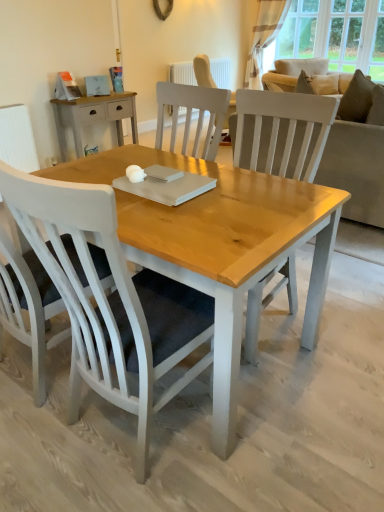
Question: Is white painted radiator at upper center further to the viewer compared to white painted wood chair at center, arranged as the 1th chair when viewed from the right?

Choices:
 (A) yes
 (B) no

Answer: (A)

Question: From a real-world perspective, is white painted radiator at upper center on top of white painted wood chair at center, marked as the 2th chair in a left-to-right arrangement?

Choices:
 (A) yes
 (B) no

Answer: (B)

Question: Considering the relative sizes of white painted radiator at upper center and white painted wood chair at center, marked as the 2th chair in a left-to-right arrangement, in the image provided, is white painted radiator at upper center wider than white painted wood chair at center, marked as the 2th chair in a left-to-right arrangement,?

Choices:
 (A) yes
 (B) no

Answer: (B)

Question: Is white painted radiator at upper center aimed at white painted wood chair at center, arranged as the 1th chair when viewed from the right?

Choices:
 (A) yes
 (B) no

Answer: (B)

Question: Considering the relative sizes of white painted radiator at upper center and white painted wood chair at center, arranged as the 1th chair when viewed from the right, in the image provided, is white painted radiator at upper center shorter than white painted wood chair at center, arranged as the 1th chair when viewed from the right,?

Choices:
 (A) yes
 (B) no

Answer: (A)

Question: Considering the positions of light brown wood desk at upper left and white painted wood chair at left, the 1th chair viewed from the left, in the image, is light brown wood desk at upper left wider or thinner than white painted wood chair at left, the 1th chair viewed from the left,?

Choices:
 (A) thin
 (B) wide

Answer: (A)

Question: Would you say light brown wood desk at upper left is to the left or to the right of white painted wood chair at left, arranged as the 2th chair when viewed from the right, in the picture?

Choices:
 (A) left
 (B) right

Answer: (A)

Question: From a real-world perspective, is light brown wood desk at upper left above or below white painted wood chair at left, the 1th chair viewed from the left?

Choices:
 (A) below
 (B) above

Answer: (A)

Question: Considering their positions, is light brown wood desk at upper left located in front of or behind white painted wood chair at left, the 1th chair viewed from the left?

Choices:
 (A) behind
 (B) front

Answer: (A)

Question: From the image's perspective, relative to suede-like beige pillow at upper right, is light beige fabric couch at upper right above or below?

Choices:
 (A) below
 (B) above

Answer: (A)

Question: Is light beige fabric couch at upper right to the left or to the right of suede-like beige pillow at upper right in the image?

Choices:
 (A) right
 (B) left

Answer: (B)

Question: Considering their positions, is light beige fabric couch at upper right located in front of or behind suede-like beige pillow at upper right?

Choices:
 (A) front
 (B) behind

Answer: (B)

Question: Is light beige fabric couch at upper right bigger or smaller than suede-like beige pillow at upper right?

Choices:
 (A) big
 (B) small

Answer: (A)

Question: Is point (226, 84) positioned closer to the camera than point (362, 192)?

Choices:
 (A) farther
 (B) closer

Answer: (A)

Question: In the image, is white painted radiator at upper center positioned in front of or behind light beige fabric couch at upper right?

Choices:
 (A) behind
 (B) front

Answer: (A)